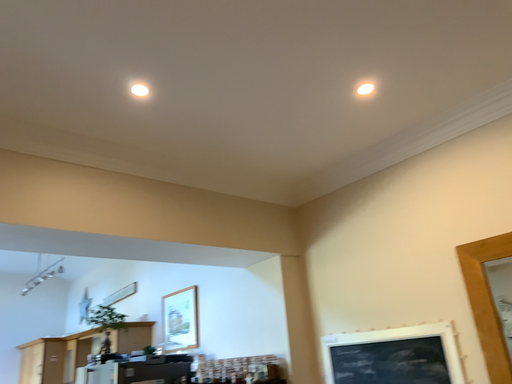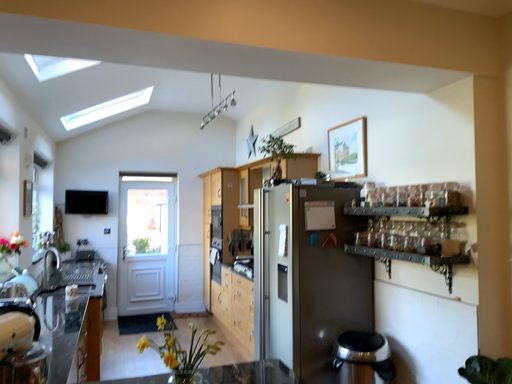
Question: Which way did the camera rotate in the video?

Choices:
 (A) rotated downward
 (B) rotated upward

Answer: (A)